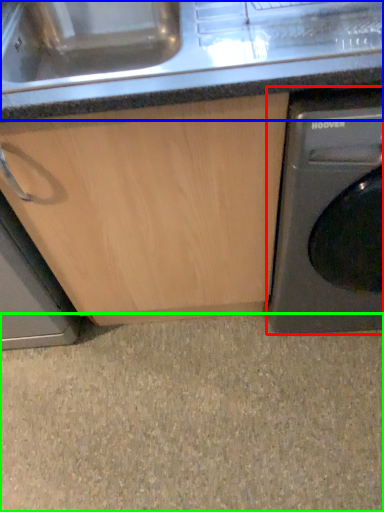
Question: Which object is positioned closest to washing machine (highlighted by a red box)? Select from counter top (highlighted by a blue box) and granite (highlighted by a green box).

Choices:
 (A) counter top
 (B) granite

Answer: (A)